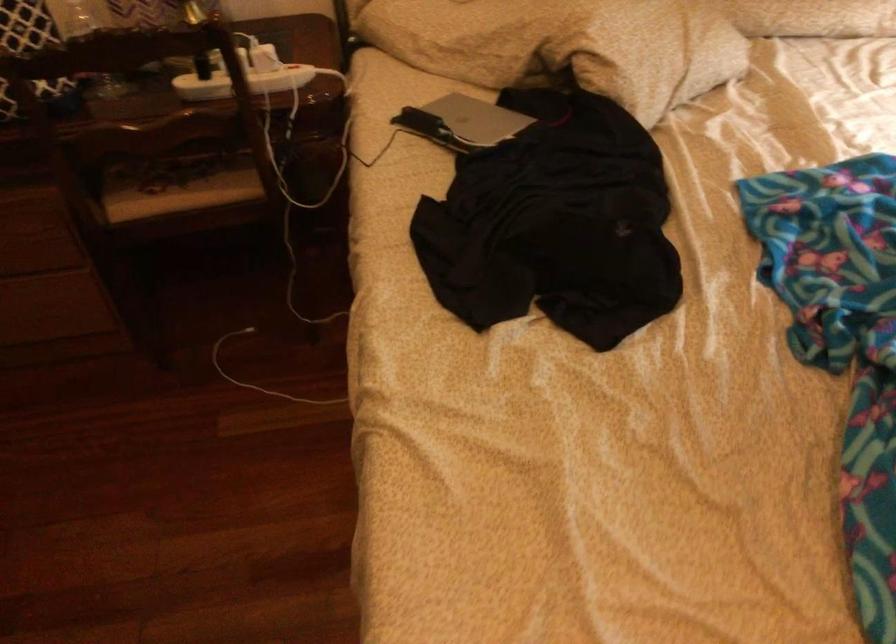
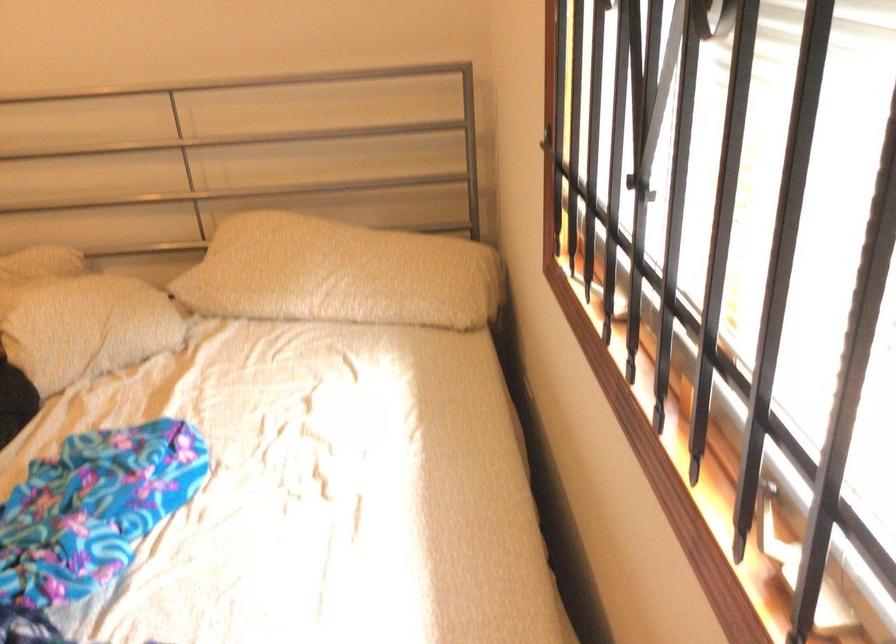
Question: The images are taken continuously from a first-person perspective. In which direction are you moving?

Choices:
 (A) Left
 (B) Right
 (C) Forward
 (D) Backward

Answer: (B)